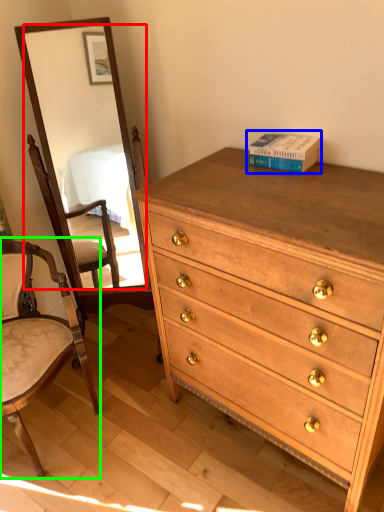
Question: Based on their relative distances, which object is nearer to mirror (highlighted by a red box)? Choose from book (highlighted by a blue box) and chair (highlighted by a green box).

Choices:
 (A) book
 (B) chair

Answer: (B)